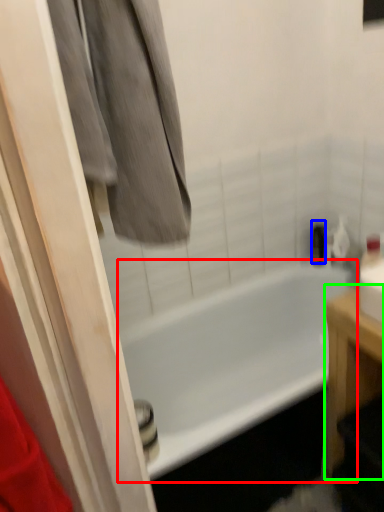
Question: Considering the real-world distances, which object is closest to bathtub (highlighted by a red box)? toiletry (highlighted by a blue box) or furniture (highlighted by a green box).

Choices:
 (A) toiletry
 (B) furniture

Answer: (A)